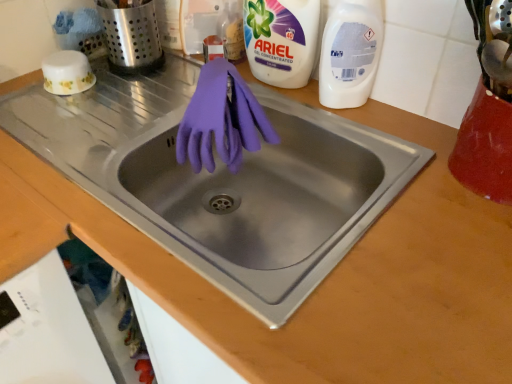
Image resolution: width=512 pixels, height=384 pixels. What are the coordinates of `vacant point to the left of white gel concentrated at upper right, which ranks as the first cleaning product in left-to-right order` in the screenshot? It's located at (186, 88).